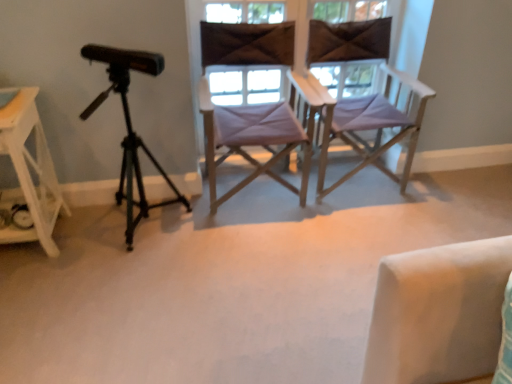
Where is `free spot in front of purple fabric chair at center, marked as the 2th chair in a right-to-left arrangement`? free spot in front of purple fabric chair at center, marked as the 2th chair in a right-to-left arrangement is located at coordinates (258, 252).